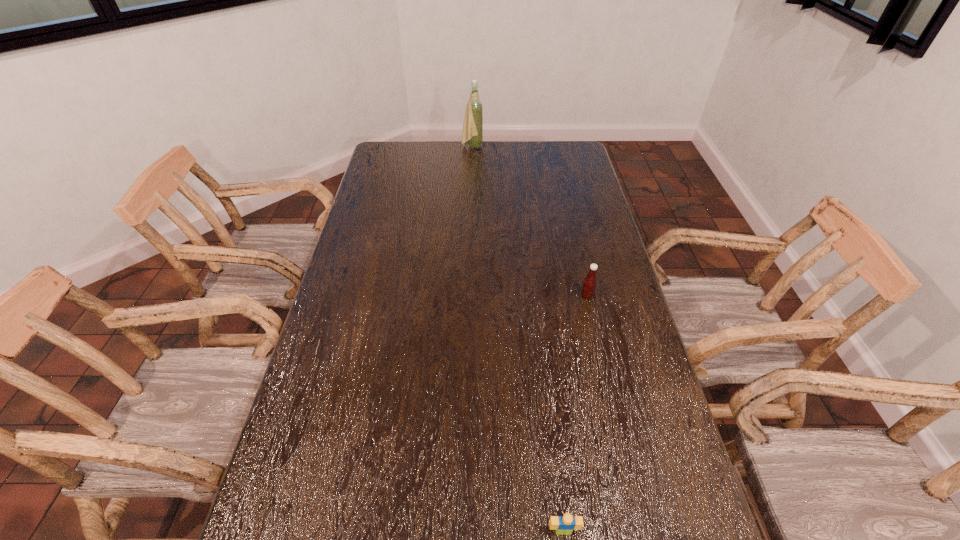
Where is `the leftmost object`? the leftmost object is located at coordinates (472, 132).

The height and width of the screenshot is (540, 960). Find the location of `the farthest object`. the farthest object is located at coordinates (472, 132).

Image resolution: width=960 pixels, height=540 pixels. What are the coordinates of `the second tallest object` in the screenshot? It's located at (589, 284).

At what (x,y) coordinates should I click in order to perform the action: click on the rightmost object. Please return your answer as a coordinate pair (x, y). Looking at the image, I should click on (589, 284).

Locate an element on the screen. Lego is located at coordinates (565, 524).

Locate an element on the screen. The height and width of the screenshot is (540, 960). the nearest object is located at coordinates (565, 524).

This screenshot has width=960, height=540. I want to click on blank space located on the front-facing side of the leftmost object, so tap(500, 146).

Locate an element on the screen. This screenshot has width=960, height=540. free space located on the left of the Tabasco sauce is located at coordinates (508, 296).

This screenshot has height=540, width=960. Find the location of `object that is at the far edge`. object that is at the far edge is located at coordinates (472, 132).

Where is `object at the right edge`? object at the right edge is located at coordinates (589, 284).